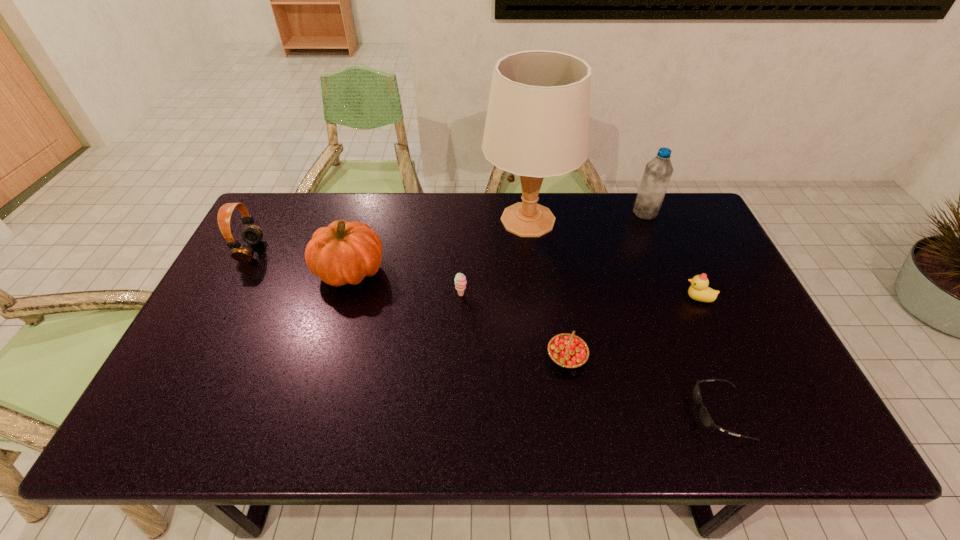
Locate an element on the screen. Image resolution: width=960 pixels, height=540 pixels. the tallest object is located at coordinates (537, 125).

In order to click on the seventh shortest object in this screenshot , I will do (658, 171).

Image resolution: width=960 pixels, height=540 pixels. In order to click on pumpkin in this screenshot , I will do `click(344, 252)`.

The height and width of the screenshot is (540, 960). What are the coordinates of `headset` in the screenshot? It's located at (252, 234).

In order to click on the third object from left to right in this screenshot , I will do `click(460, 280)`.

What are the coordinates of `duckling` in the screenshot? It's located at (699, 290).

Find the location of `strawberry`. strawberry is located at coordinates (569, 351).

Locate an element on the screen. sunglasses is located at coordinates (705, 417).

The height and width of the screenshot is (540, 960). What are the coordinates of `the shortest object` in the screenshot? It's located at (705, 417).

You are a GUI agent. You are given a task and a screenshot of the screen. Output one action in this format:
    pyautogui.click(x=<x>, y=<y>)
    Task: Click on the vacant space situated on the front of the table lamp
    
    Given the screenshot: What is the action you would take?
    pyautogui.click(x=538, y=303)